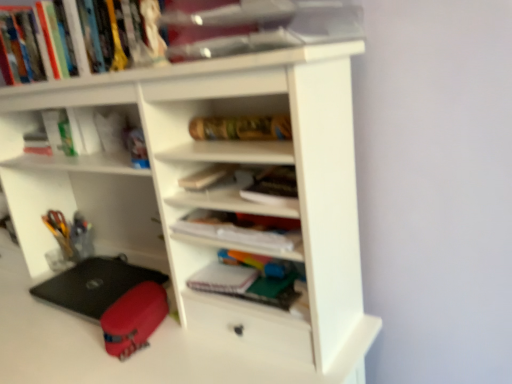
Question: Visually, is hardcover book at center, which is the fourth book from top to bottom, positioned to the left or to the right of black matte laptop at lower left?

Choices:
 (A) left
 (B) right

Answer: (B)

Question: In terms of width, does hardcover book at center, which is the fourth book from top to bottom, look wider or thinner when compared to black matte laptop at lower left?

Choices:
 (A) thin
 (B) wide

Answer: (A)

Question: Which is nearer to the black matte laptop at lower left?

Choices:
 (A) matte white book at center, the fourth book ordered from the bottom
 (B) white paper notebook at center, which appears as the 5th book when viewed from the top
 (C) wooden textured book at center, placed as the 2th book when sorted from top to bottom
 (D) hardcover book at center, the third book in the bottom-to-top sequence
 (E) hardcover book at upper left, which appears as the first book when viewed from the top

Answer: (B)

Question: Estimate the real-world distances between objects in this image. Which object is closer to the hardcover book at center, the third book in the bottom-to-top sequence?

Choices:
 (A) white paper notebook at center, the 2th book from the bottom
 (B) hardcover book at upper left, which is the sixth book in bottom-to-top order
 (C) matte white book at center, the fourth book ordered from the bottom
 (D) rubberized red suitcase at lower left
 (E) black matte laptop at lower left

Answer: (A)